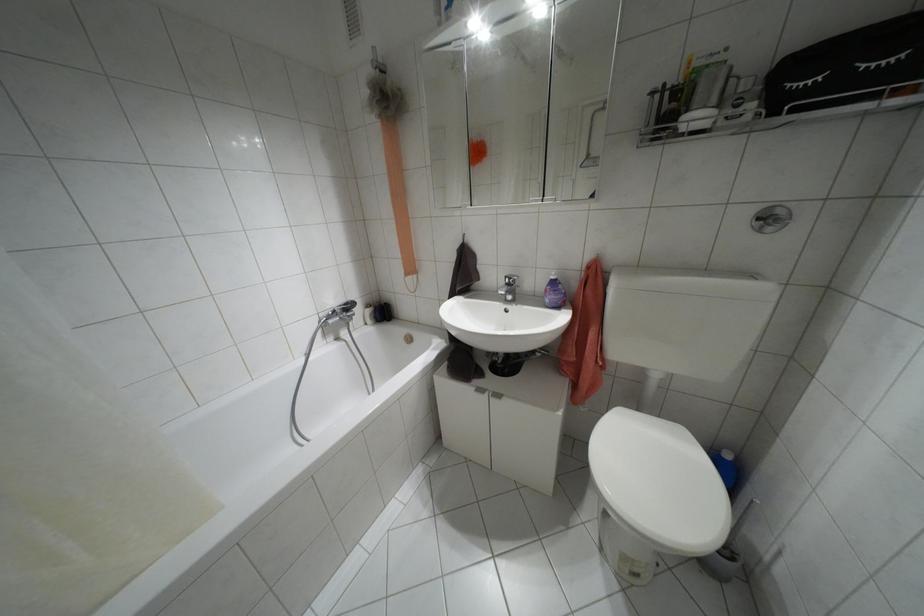
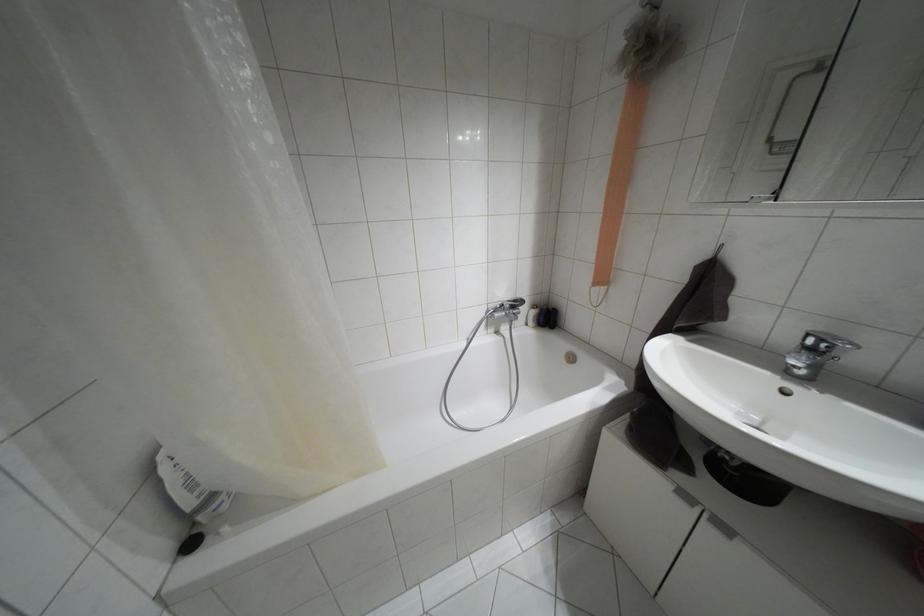
Where in the second image is the point corresponding to (345,304) from the first image?

(514, 301)